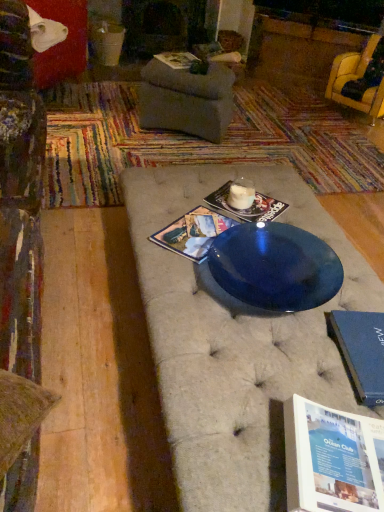
Question: Is matte paper magazine at upper center, which is the first magazine from top to bottom, completely or partially outside of blue hardcover book at lower right?

Choices:
 (A) no
 (B) yes

Answer: (B)

Question: Can you confirm if matte paper magazine at upper center, which is the first magazine from back to front, is smaller than blue hardcover book at lower right?

Choices:
 (A) yes
 (B) no

Answer: (A)

Question: Can you confirm if matte paper magazine at upper center, the third magazine in the front-to-back sequence, is shorter than blue hardcover book at lower right?

Choices:
 (A) yes
 (B) no

Answer: (A)

Question: Is matte paper magazine at upper center, which is the first magazine from top to bottom, directly adjacent to blue hardcover book at lower right?

Choices:
 (A) yes
 (B) no

Answer: (B)

Question: Does matte paper magazine at upper center, the third magazine in the front-to-back sequence, turn towards blue hardcover book at lower right?

Choices:
 (A) yes
 (B) no

Answer: (A)

Question: Is blue hardcover book at lower right at the back of matte paper magazine at upper center, which is the first magazine from back to front?

Choices:
 (A) yes
 (B) no

Answer: (B)

Question: Can you confirm if white glossy plate at center is shorter than blue hardcover book at lower right?

Choices:
 (A) yes
 (B) no

Answer: (A)

Question: Does white glossy plate at center contain blue hardcover book at lower right?

Choices:
 (A) no
 (B) yes

Answer: (A)

Question: Considering the relative sizes of white glossy plate at center and blue hardcover book at lower right in the image provided, is white glossy plate at center wider than blue hardcover book at lower right?

Choices:
 (A) yes
 (B) no

Answer: (B)

Question: Can you confirm if white glossy plate at center is positioned to the left of blue hardcover book at lower right?

Choices:
 (A) yes
 (B) no

Answer: (A)

Question: Is white glossy plate at center far away from blue hardcover book at lower right?

Choices:
 (A) yes
 (B) no

Answer: (B)

Question: From a real-world perspective, is white glossy plate at center beneath blue hardcover book at lower right?

Choices:
 (A) yes
 (B) no

Answer: (B)

Question: Are matte paper magazine at upper center, the third magazine in the front-to-back sequence, and gray fabric footrest at center located far from each other?

Choices:
 (A) no
 (B) yes

Answer: (A)